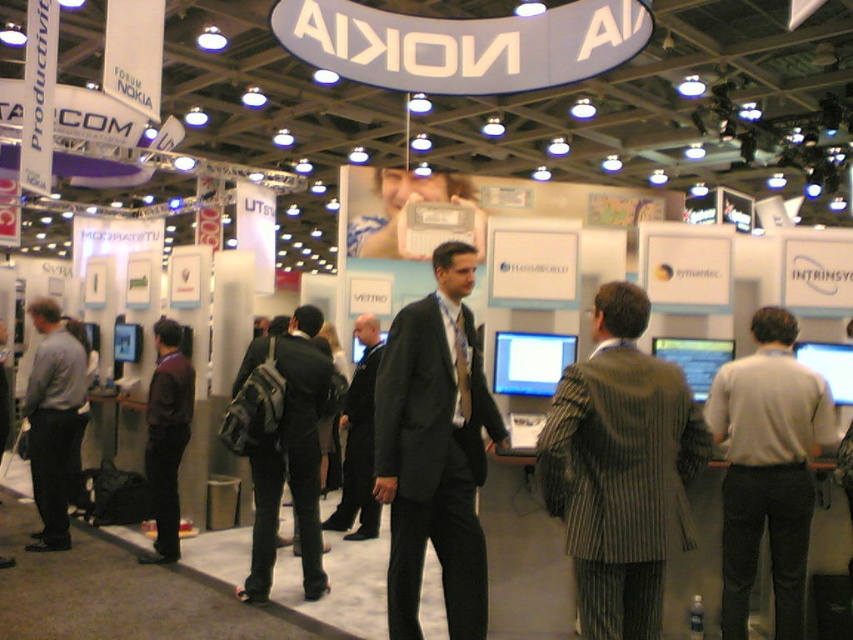
Question: Which point is closer to the camera taking this photo?

Choices:
 (A) (788, 588)
 (B) (169, 323)

Answer: (A)

Question: Which of the following is the closest to the observer?

Choices:
 (A) black suit at center
 (B) matte gray shirt at left
 (C) striped wool suit at center
 (D) dark gray backpack at center

Answer: (C)

Question: Is dark gray suit at center behind dark gray backpack at center?

Choices:
 (A) yes
 (B) no

Answer: (B)

Question: In this image, where is dark gray suit at center located relative to gray wool sweater at right?

Choices:
 (A) right
 (B) left

Answer: (B)

Question: Can you confirm if striped wool suit at center is thinner than dark gray backpack at center?

Choices:
 (A) yes
 (B) no

Answer: (A)

Question: Which of the following is the farthest from the observer?

Choices:
 (A) (154, 328)
 (B) (277, 349)
 (C) (741, 436)

Answer: (A)